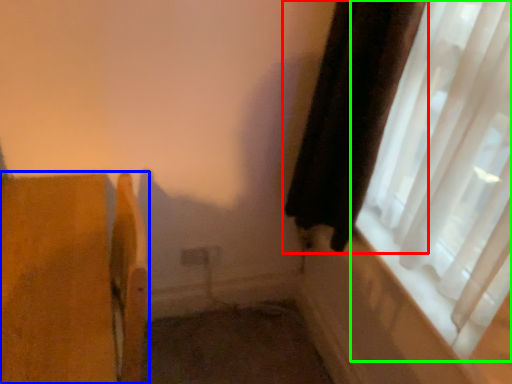
Question: Based on their relative distances, which object is farther from curtain (highlighted by a red box)? Choose from furniture (highlighted by a blue box) and window (highlighted by a green box).

Choices:
 (A) furniture
 (B) window

Answer: (A)